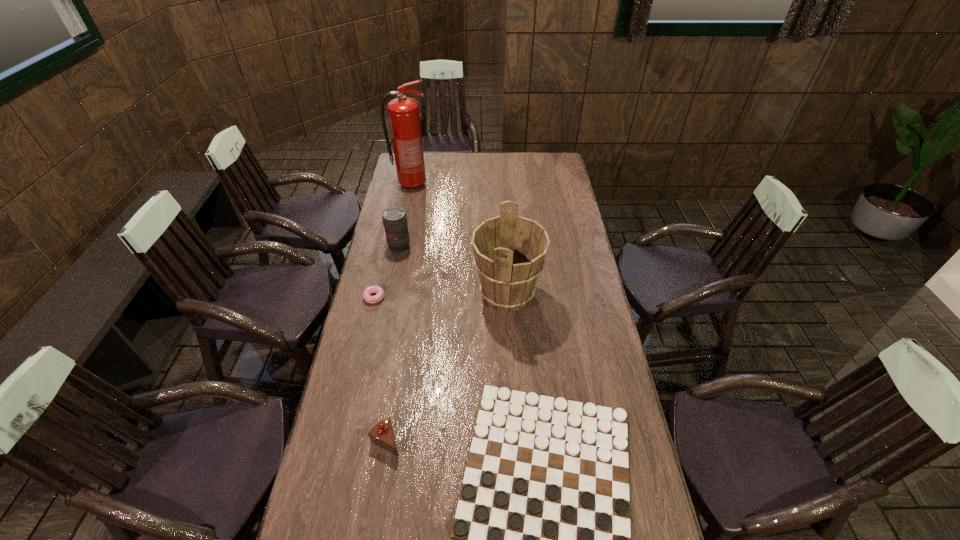
At what (x,y) coordinates should I click in order to perform the action: click on vacant area that lies between the third tallest object and the third shortest object. Please return your answer as a coordinate pair (x, y). Looking at the image, I should click on (393, 344).

Identify the location of vacant space in between the farthest object and the second tallest object. coord(459,240).

Image resolution: width=960 pixels, height=540 pixels. I want to click on free space that is in between the bucket and the doughnut, so click(x=442, y=296).

At what (x,y) coordinates should I click in order to perform the action: click on unoccupied area between the third shortest object and the doughnut. Please return your answer as a coordinate pair (x, y). The width and height of the screenshot is (960, 540). Looking at the image, I should click on (381, 369).

Locate an element on the screen. Image resolution: width=960 pixels, height=540 pixels. free space between the bucket and the fourth tallest object is located at coordinates (446, 368).

The width and height of the screenshot is (960, 540). Identify the location of object that ranks as the third closest to the third shortest object. (367, 297).

Image resolution: width=960 pixels, height=540 pixels. Identify the location of the closest object to the doughnut. (394, 218).

Identify the location of free spot that satisfies the following two spatial constraints: 1. on the side of the second farthest object where the control switches are located; 2. on the left side of the second tallest object. (390, 295).

This screenshot has width=960, height=540. What are the coordinates of `free space that satisfies the following two spatial constraints: 1. on the handle side the fire extinguisher; 2. on the side of the telephoto lens where the control switches are located` in the screenshot? It's located at (399, 247).

At what (x,y) coordinates should I click in order to perform the action: click on free space that satisfies the following two spatial constraints: 1. on the side of the second farthest object where the control switches are located; 2. on the right side of the fourth tallest object. Please return your answer as a coordinate pair (x, y). Looking at the image, I should click on (361, 441).